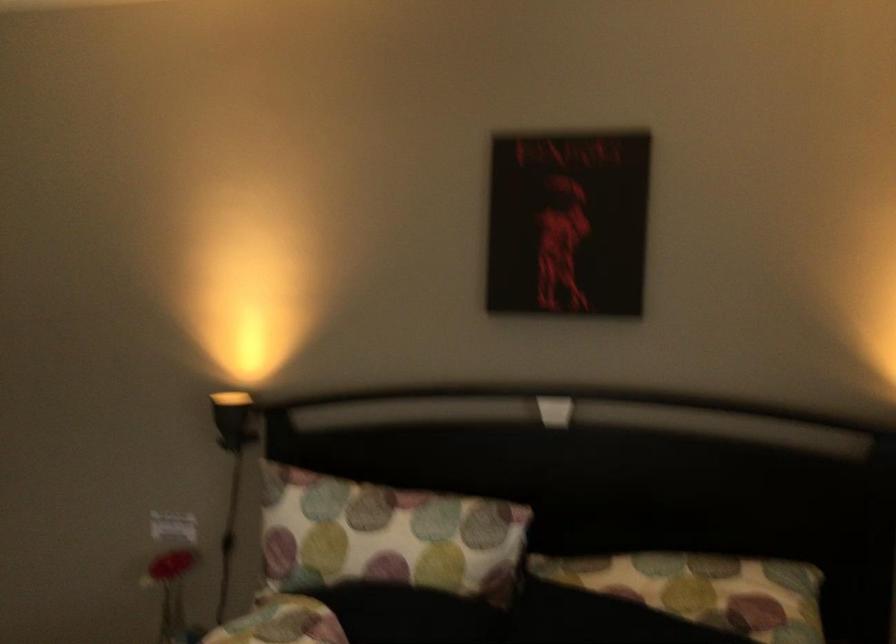
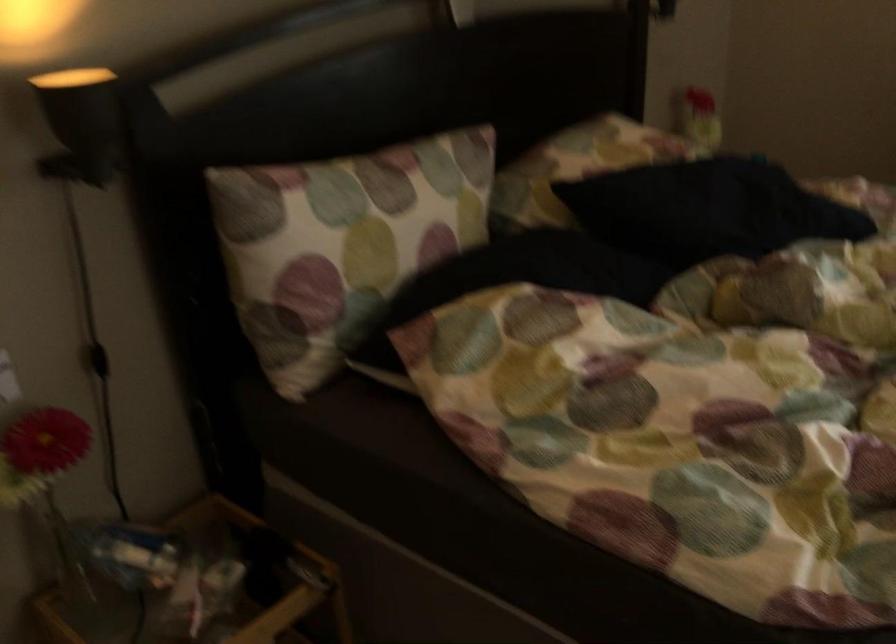
Find the pixel in the second image that matches point 234,538 in the first image.

(98, 360)